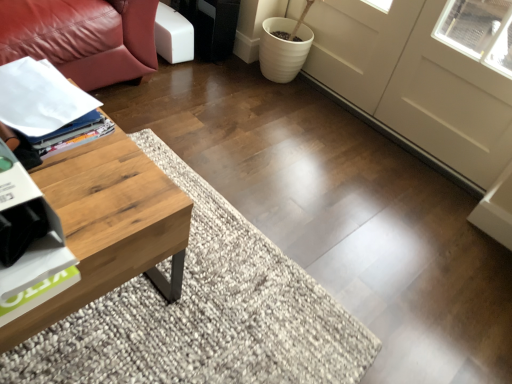
What do you see at coordinates (423, 75) in the screenshot? This screenshot has height=384, width=512. I see `white matte screen door at center` at bounding box center [423, 75].

Locate an element on the screen. The height and width of the screenshot is (384, 512). white glossy magazine at left is located at coordinates coord(42,101).

Image resolution: width=512 pixels, height=384 pixels. Find the location of `white matte screen door at center`. white matte screen door at center is located at coordinates (423, 75).

Can you confirm if white glossy magazine at left is thinner than white matte screen door at center?

In fact, white glossy magazine at left might be wider than white matte screen door at center.

Consider the image. From a real-world perspective, is white glossy magazine at left above or below white matte screen door at center?

From a real-world perspective, white glossy magazine at left is physically above white matte screen door at center.

Is white glossy magazine at left at the left side of white matte screen door at center?

Indeed, white glossy magazine at left is positioned on the left side of white matte screen door at center.

Which is more to the left, woodenmaterial/texturecoffee table at left or white matte screen door at center?

Positioned to the left is woodenmaterial/texturecoffee table at left.

From a real-world perspective, is woodenmaterial/texturecoffee table at left beneath white matte screen door at center?

Yes, from a real-world perspective, woodenmaterial/texturecoffee table at left is below white matte screen door at center.

Which object is closer to the camera taking this photo, woodenmaterial/texturecoffee table at left or white matte screen door at center?

Positioned in front is woodenmaterial/texturecoffee table at left.

What's the angular difference between woodenmaterial/texturecoffee table at left and white matte screen door at center's facing directions?

The angular difference between woodenmaterial/texturecoffee table at left and white matte screen door at center is 89.4 degrees.

Looking at this image, can you confirm if white matte screen door at center is wider than woodenmaterial/texturecoffee table at left?

No, white matte screen door at center is not wider than woodenmaterial/texturecoffee table at left.

Is white matte screen door at center not close to woodenmaterial/texturecoffee table at left?

Yes, white matte screen door at center is far from woodenmaterial/texturecoffee table at left.

You are a GUI agent. You are given a task and a screenshot of the screen. Output one action in this format:
    pyautogui.click(x=<x>, y=<y>)
    Task: Click on the coffee table below the white matte screen door at center (from a real-world perspective)
    The height and width of the screenshot is (384, 512).
    Given the screenshot: What is the action you would take?
    pyautogui.click(x=109, y=225)

Does point (396, 103) come behind point (111, 277)?

Yes, point (396, 103) is farther from viewer.

Which of these two, woodenmaterial/texturecoffee table at left or white glossy magazine at left, is wider?

woodenmaterial/texturecoffee table at left.

Locate an element on the screen. This screenshot has width=512, height=384. coffee table below the white glossy magazine at left (from a real-world perspective) is located at coordinates pos(109,225).

Which object is positioned more to the left, woodenmaterial/texturecoffee table at left or white glossy magazine at left?

Positioned to the left is woodenmaterial/texturecoffee table at left.

From the picture: Would you say white glossy magazine at left is part of white matte screen door at center's contents?

No, white glossy magazine at left is not surrounded by white matte screen door at center.

From the image's perspective, is white matte screen door at center under white glossy magazine at left?

Incorrect, from the image's perspective, white matte screen door at center is higher than white glossy magazine at left.

From a real-world perspective, which is physically above, white matte screen door at center or white glossy magazine at left?

white glossy magazine at left, from a real-world perspective.

Is woodenmaterial/texturecoffee table at left located within white glossy magazine at left?

No, woodenmaterial/texturecoffee table at left is located outside of white glossy magazine at left.

Based on their positions, is white glossy magazine at left located to the left or right of woodenmaterial/texturecoffee table at left?

Based on their positions, white glossy magazine at left is located to the right of woodenmaterial/texturecoffee table at left.

In the image, is white glossy magazine at left positioned in front of or behind woodenmaterial/texturecoffee table at left?

white glossy magazine at left is positioned farther from the viewer than woodenmaterial/texturecoffee table at left.

There is a white matte screen door at center. Where is `magazine above it (from a real-world perspective)`? This screenshot has height=384, width=512. magazine above it (from a real-world perspective) is located at coordinates (42, 101).

Locate an element on the screen. This screenshot has height=384, width=512. screen door behind the woodenmaterial/texturecoffee table at left is located at coordinates [423, 75].

From the image, which object appears to be farther from white matte screen door at center, white glossy magazine at left or woodenmaterial/texturecoffee table at left?

Based on the image, woodenmaterial/texturecoffee table at left appears to be further to white matte screen door at center.

From the image, which object appears to be farther from white matte screen door at center, woodenmaterial/texturecoffee table at left or white glossy magazine at left?

woodenmaterial/texturecoffee table at left.

From the picture: From the image, which object appears to be nearer to white glossy magazine at left, woodenmaterial/texturecoffee table at left or white matte screen door at center?

Based on the image, woodenmaterial/texturecoffee table at left appears to be nearer to white glossy magazine at left.

Which object lies nearer to the anchor point woodenmaterial/texturecoffee table at left, white matte screen door at center or white glossy magazine at left?

white glossy magazine at left is closer to woodenmaterial/texturecoffee table at left.

Looking at the image, which one is located closer to white glossy magazine at left, white matte screen door at center or woodenmaterial/texturecoffee table at left?

woodenmaterial/texturecoffee table at left is positioned closer to the anchor white glossy magazine at left.

Estimate the real-world distances between objects in this image. Which object is further from woodenmaterial/texturecoffee table at left, white glossy magazine at left or white matte screen door at center?

white matte screen door at center is positioned further to the anchor woodenmaterial/texturecoffee table at left.

I want to click on magazine located between woodenmaterial/texturecoffee table at left and white matte screen door at center in the left-right direction, so click(x=42, y=101).